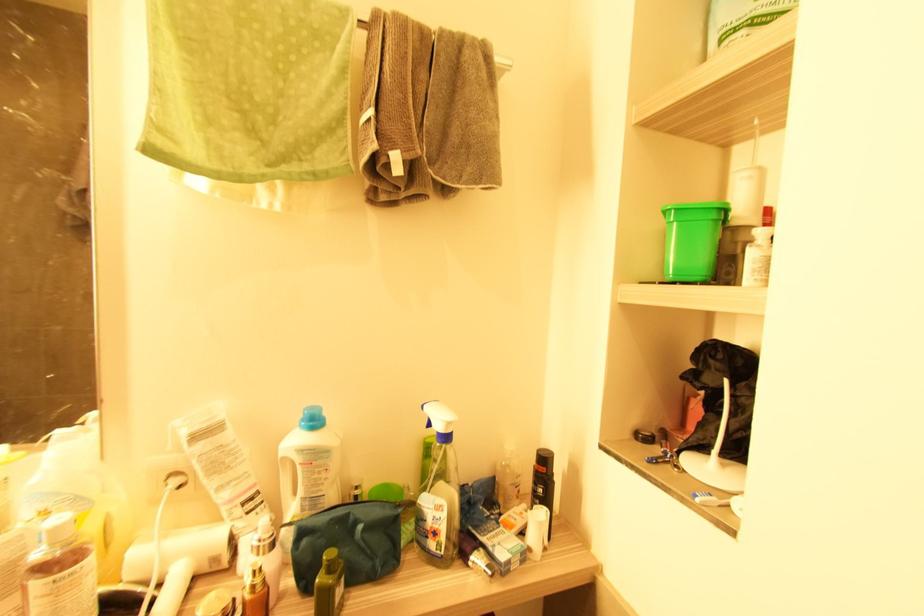
This screenshot has height=616, width=924. I want to click on white plastic tube, so [x=180, y=552].